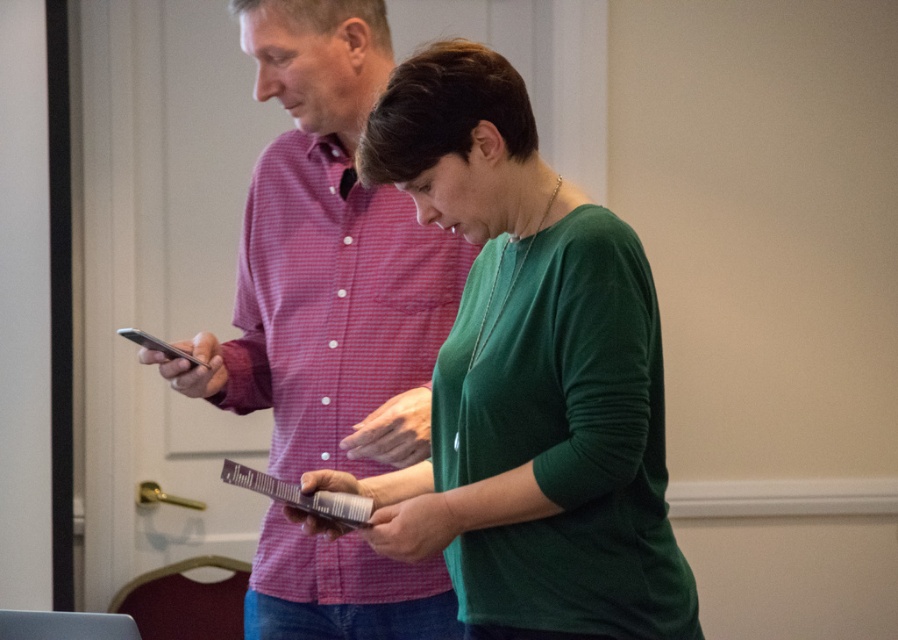
Question: Can you confirm if green matte cardigan at center is positioned to the left of matte pink shirt at center?

Choices:
 (A) yes
 (B) no

Answer: (B)

Question: Which of the following is the closest to the observer?

Choices:
 (A) matte pink shirt at center
 (B) green matte cardigan at center

Answer: (B)

Question: Which of the following is the closest to the observer?

Choices:
 (A) (507, 598)
 (B) (283, 552)

Answer: (A)

Question: Can you confirm if green matte cardigan at center is wider than matte pink shirt at center?

Choices:
 (A) no
 (B) yes

Answer: (B)

Question: Is green matte cardigan at center to the right of matte pink shirt at center from the viewer's perspective?

Choices:
 (A) yes
 (B) no

Answer: (A)

Question: Which object appears farthest from the camera in this image?

Choices:
 (A) green matte cardigan at center
 (B) matte pink shirt at center

Answer: (B)